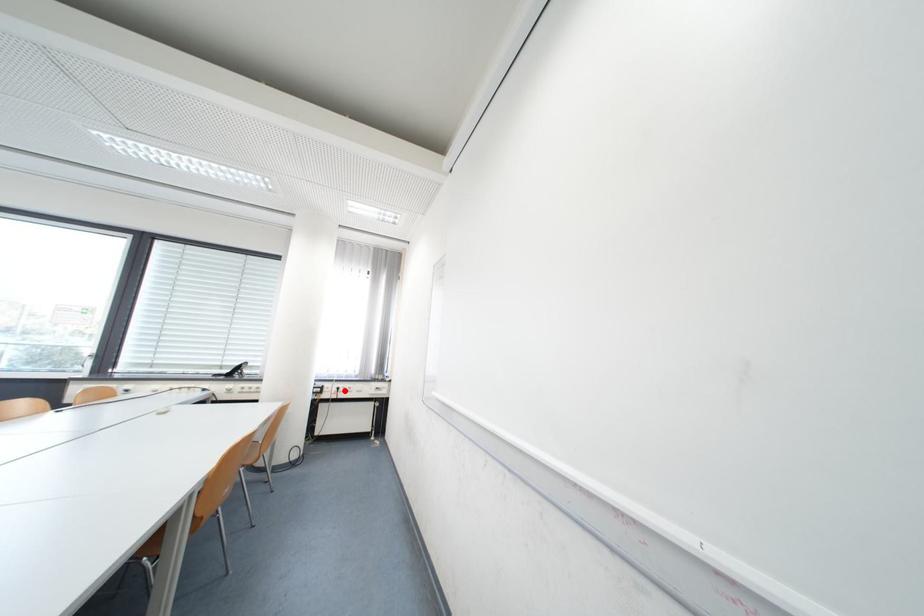
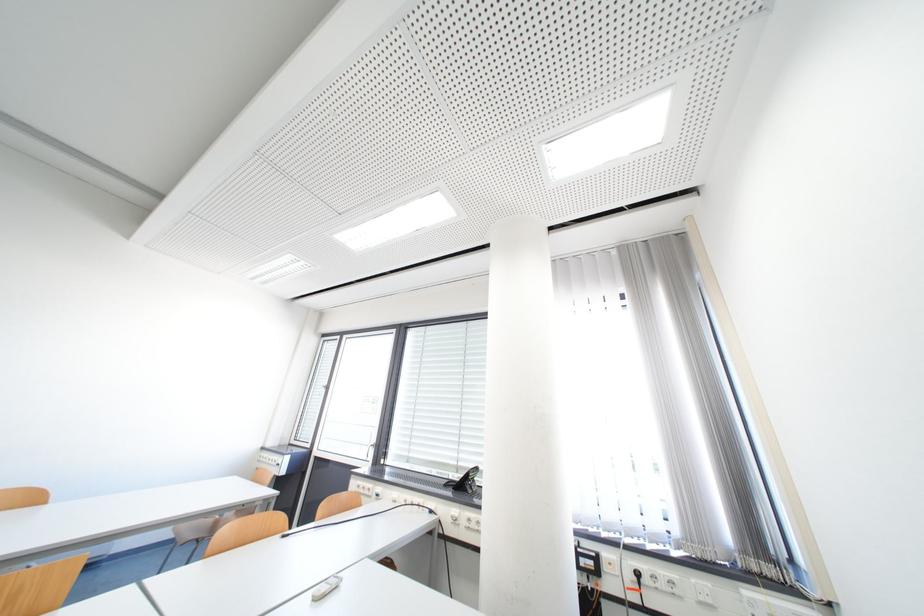
Question: I am providing you with two images of the same scene from different viewpoints. Given a red point in image1, look at the same physical point in image2. Is it:

Choices:
 (A) Closer to the viewpoint
 (B) Farther from the viewpoint

Answer: (A)